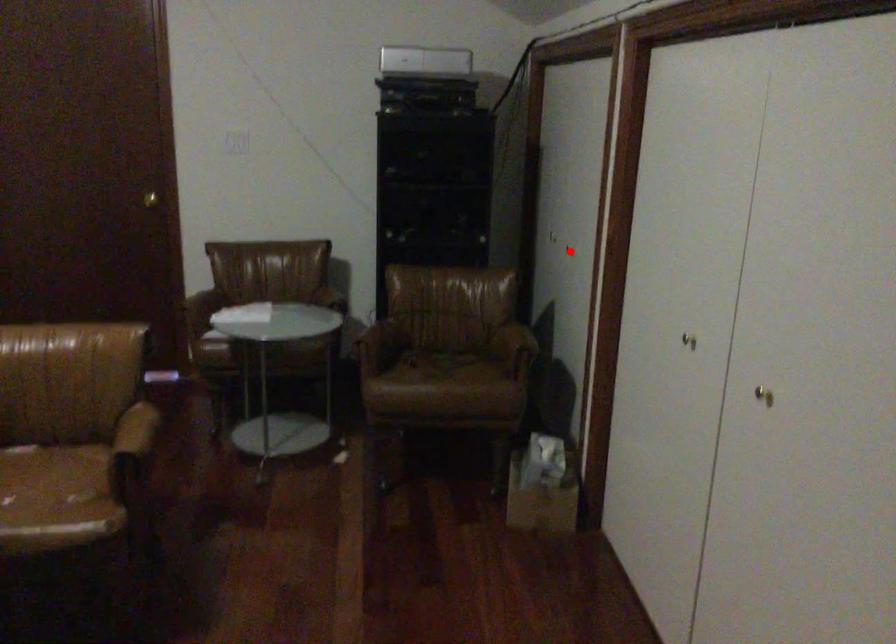
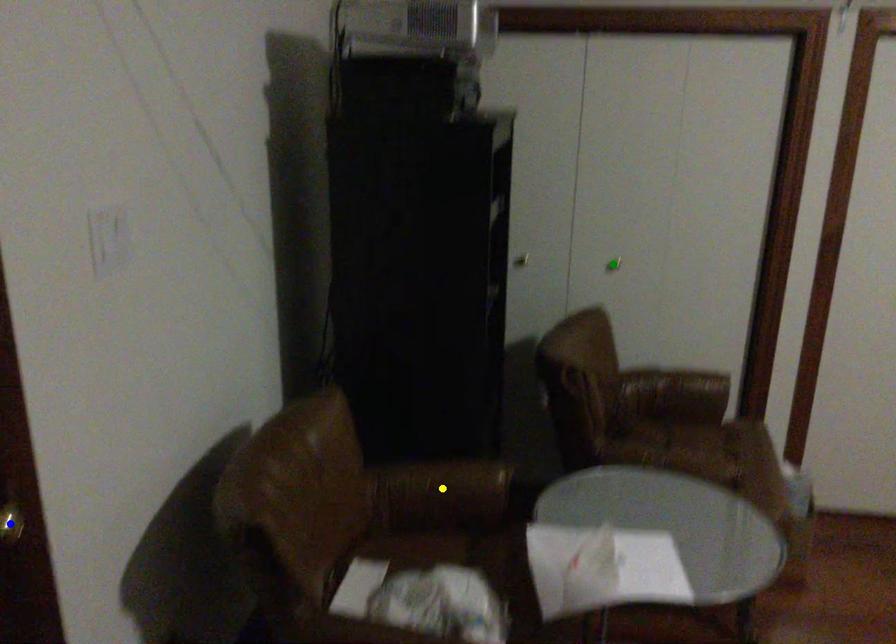
Question: I am providing you with two images of the same scene from different viewpoints. A red point is marked on the first image. You are given multiple points on the second image. Which point in image 2 represents the same 3d spot as the red point in image 1?

Choices:
 (A) blue point
 (B) green point
 (C) yellow point

Answer: (B)